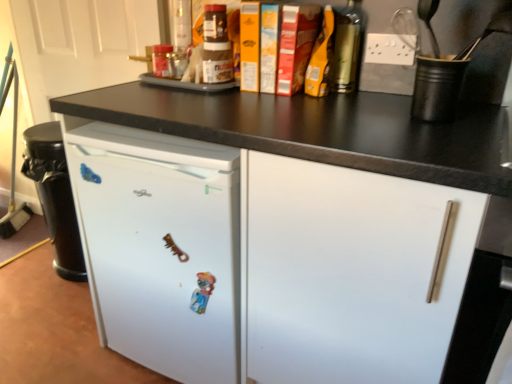
Where is `empty space that is to the right of black matte cup at upper right`? The image size is (512, 384). empty space that is to the right of black matte cup at upper right is located at coordinates click(x=487, y=113).